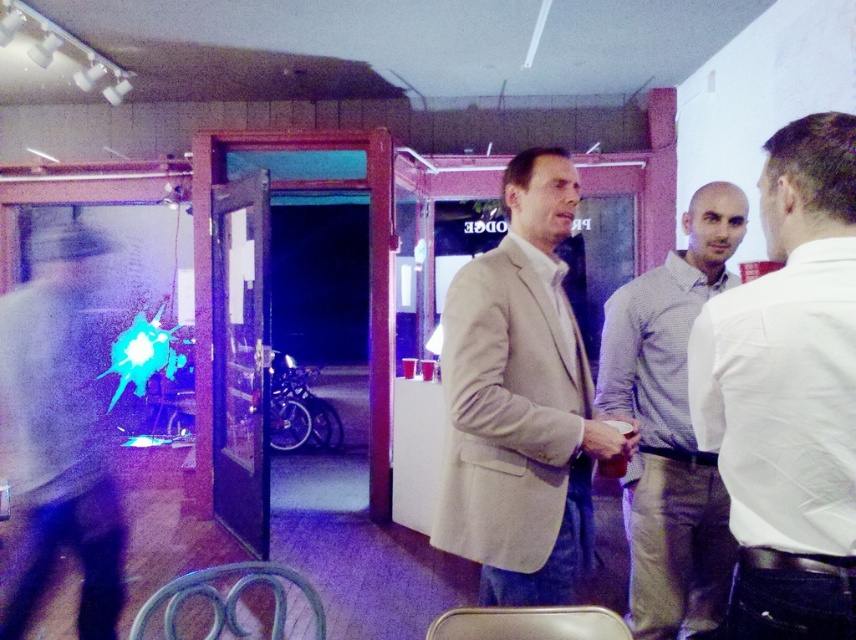
Question: Which point appears closest to the camera in this image?

Choices:
 (A) (49, 307)
 (B) (443, 321)

Answer: (B)

Question: Which point is closer to the camera?

Choices:
 (A) (645, 330)
 (B) (697, 435)
 (C) (52, 353)

Answer: (B)

Question: Does light beige suit at center have a larger size compared to matte black jacket at left?

Choices:
 (A) no
 (B) yes

Answer: (A)

Question: Which of the following is the closest to the observer?

Choices:
 (A) (740, 536)
 (B) (495, 428)

Answer: (A)

Question: Is white shirt at center bigger than matte black jacket at left?

Choices:
 (A) yes
 (B) no

Answer: (B)

Question: Is light beige suit at center to the right of matte black jacket at left from the viewer's perspective?

Choices:
 (A) yes
 (B) no

Answer: (A)